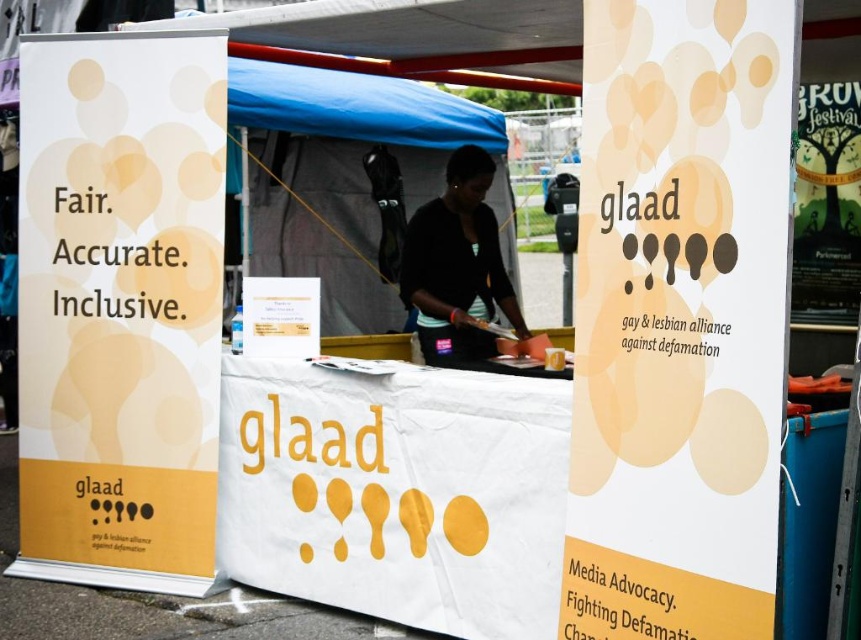
Question: Which point is closer to the camera?

Choices:
 (A) (488, 221)
 (B) (298, 220)

Answer: (A)

Question: Which point is farther to the camera?

Choices:
 (A) (326, 253)
 (B) (414, 268)

Answer: (A)

Question: Can you confirm if blue fabric tent at center is positioned below black matte shirt at center?

Choices:
 (A) no
 (B) yes

Answer: (A)

Question: Which object appears farthest from the camera in this image?

Choices:
 (A) black matte shirt at center
 (B) blue fabric tent at center

Answer: (B)

Question: Is the position of blue fabric tent at center less distant than that of black matte shirt at center?

Choices:
 (A) yes
 (B) no

Answer: (B)

Question: Is blue fabric tent at center wider than black matte shirt at center?

Choices:
 (A) no
 (B) yes

Answer: (B)